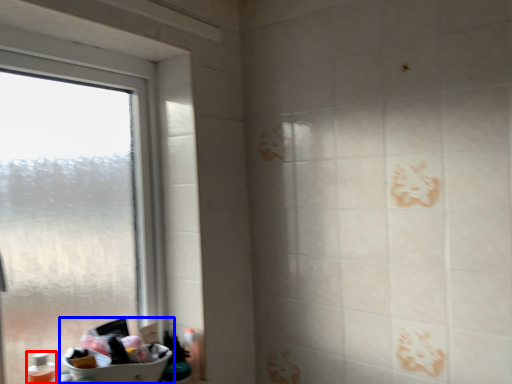
Question: Which of the following is the closest to the observer, toiletry (highlighted by a red box) or sink (highlighted by a blue box)?

Choices:
 (A) toiletry
 (B) sink

Answer: (B)